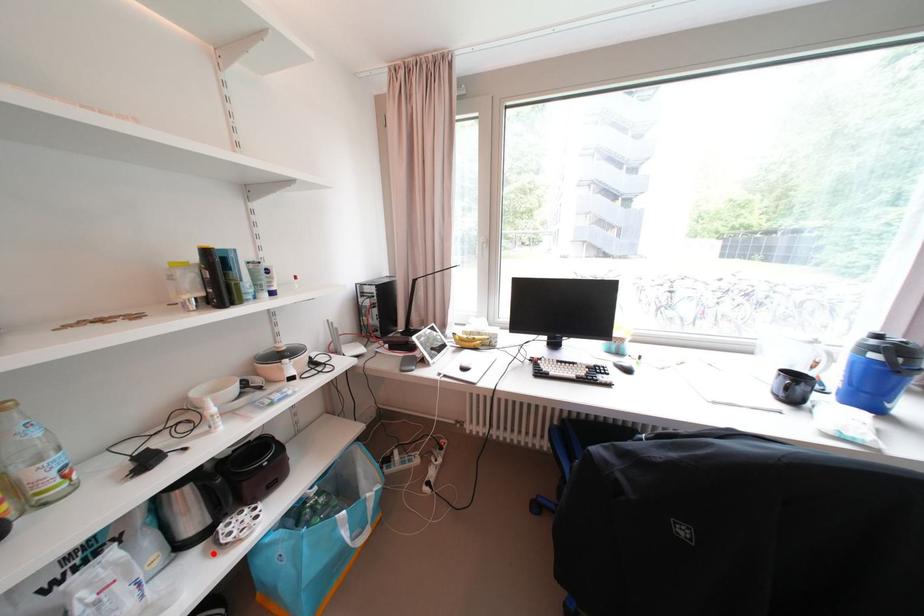
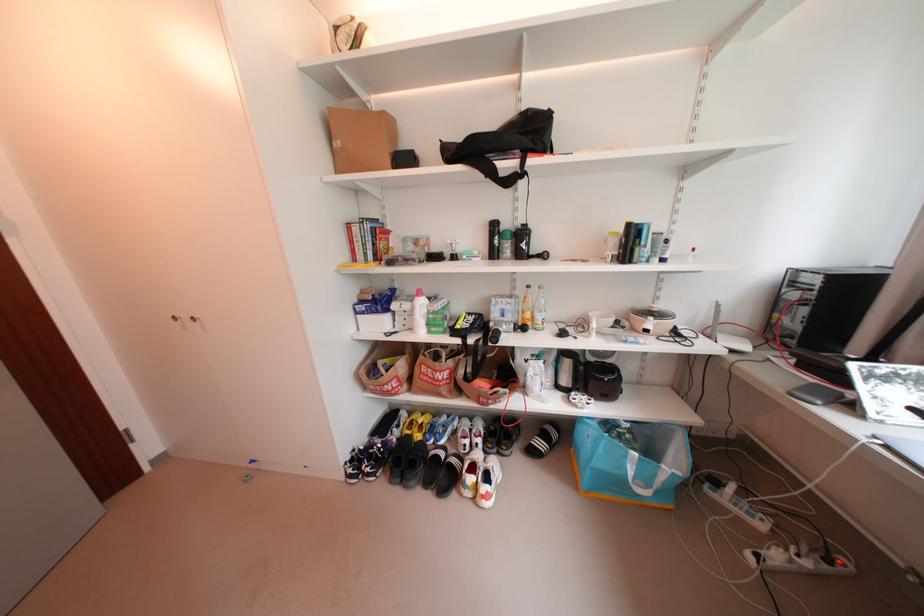
The point at the highlighted location is marked in the first image. Where is the corresponding point in the second image?

(572, 399)